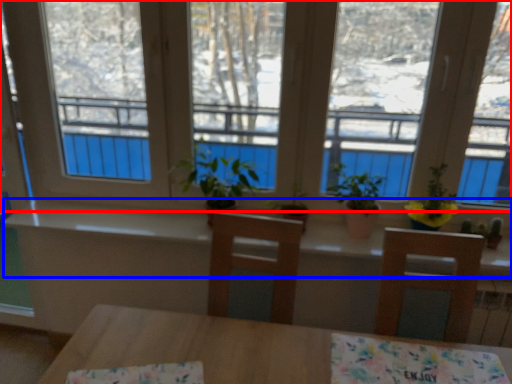
Question: Among these objects, which one is nearest to the camera, window (highlighted by a red box) or counter top (highlighted by a blue box)?

Choices:
 (A) window
 (B) counter top

Answer: (A)